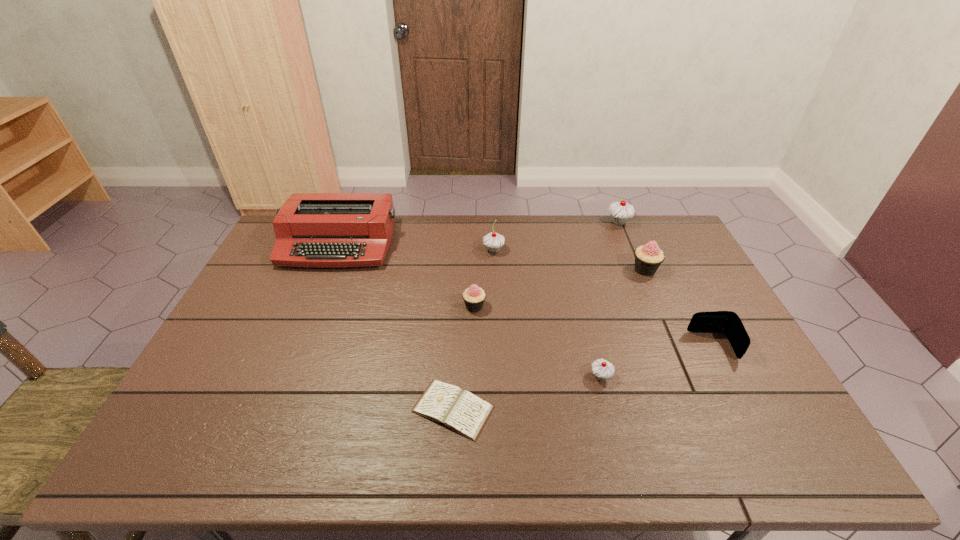
Image resolution: width=960 pixels, height=540 pixels. Identify the location of vacant space at the far edge of the desktop. (561, 231).

I want to click on vacant space at the near edge of the desktop, so (x=506, y=465).

The width and height of the screenshot is (960, 540). I want to click on free space at the right edge, so click(709, 384).

Locate an element on the screen. The width and height of the screenshot is (960, 540). vacant space at the far right corner is located at coordinates (648, 225).

This screenshot has height=540, width=960. In order to click on free space between the second gray cupcake from left to right and the third nearest cupcake in this screenshot , I will do `click(623, 323)`.

Identify the location of free space that is in between the smallest gray cupcake and the bigger pink cupcake. Image resolution: width=960 pixels, height=540 pixels. (623, 323).

At what (x,y) coordinates should I click in order to perform the action: click on free area in between the right pink cupcake and the diary. Please return your answer as a coordinate pair (x, y). Looking at the image, I should click on (549, 339).

Locate an element on the screen. The height and width of the screenshot is (540, 960). vacant area that lies between the bigger pink cupcake and the third nearest object is located at coordinates [679, 308].

Image resolution: width=960 pixels, height=540 pixels. I want to click on vacant area between the third cupcake from right to left and the shortest object, so click(x=527, y=393).

This screenshot has width=960, height=540. I want to click on free area in between the farthest cupcake and the typewriter, so click(478, 233).